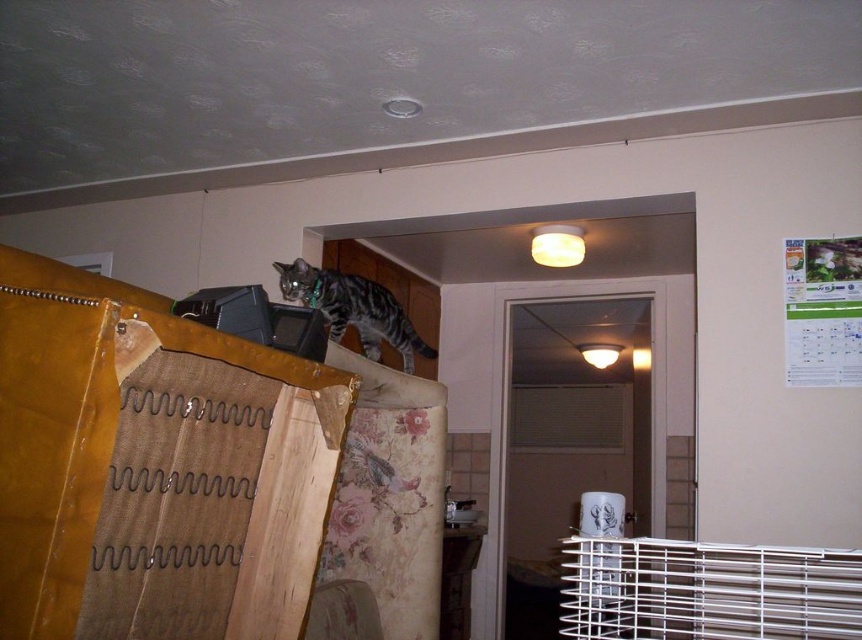
Question: Does white metal cage at lower right come in front of tabby fur cat at upper left?

Choices:
 (A) yes
 (B) no

Answer: (A)

Question: Which point appears farthest from the camera in this image?

Choices:
 (A) (629, 550)
 (B) (395, 336)

Answer: (B)

Question: Is white metal cage at lower right wider than tabby fur cat at upper left?

Choices:
 (A) no
 (B) yes

Answer: (B)

Question: Does white metal cage at lower right appear on the right side of tabby fur cat at upper left?

Choices:
 (A) yes
 (B) no

Answer: (A)